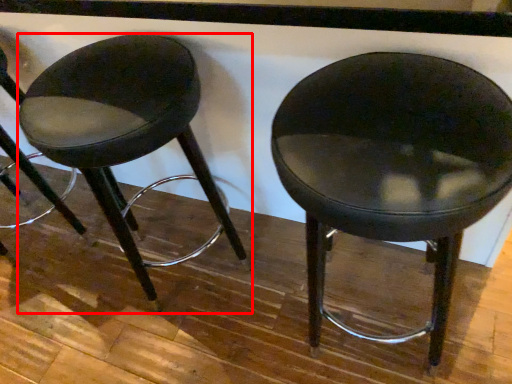
Question: Considering the relative positions of stool (annotated by the red box) and chair in the image provided, where is stool (annotated by the red box) located with respect to the staircase?

Choices:
 (A) left
 (B) right

Answer: (A)